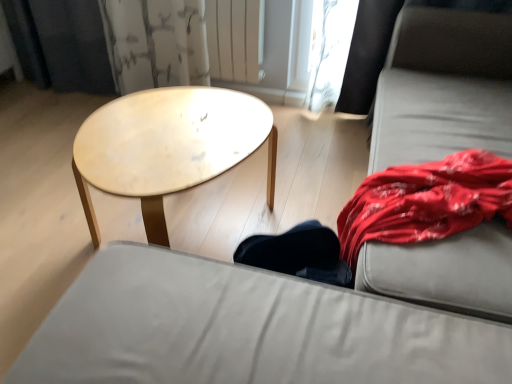
Question: From the image's perspective, is light wood/texture coffee table at center located above or below white painted metal radiator at upper center?

Choices:
 (A) above
 (B) below

Answer: (B)

Question: From a real-world perspective, is light wood/texture coffee table at center above or below white painted metal radiator at upper center?

Choices:
 (A) above
 (B) below

Answer: (B)

Question: Based on their relative distances, which object is farther from the gray fabric couch at right?

Choices:
 (A) light wood/texture coffee table at center
 (B) white painted metal radiator at upper center
 (C) matte gray studio couch at center

Answer: (B)

Question: Which of these objects is positioned farthest from the white painted metal radiator at upper center?

Choices:
 (A) matte gray studio couch at center
 (B) gray fabric couch at right
 (C) light wood/texture coffee table at center

Answer: (A)